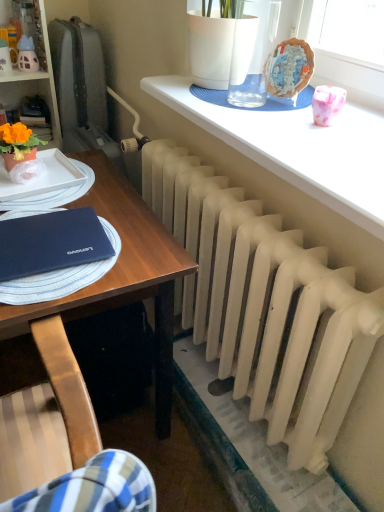
In order to click on vacant space to the right of matte black notebook at left in this screenshot , I will do point(130,256).